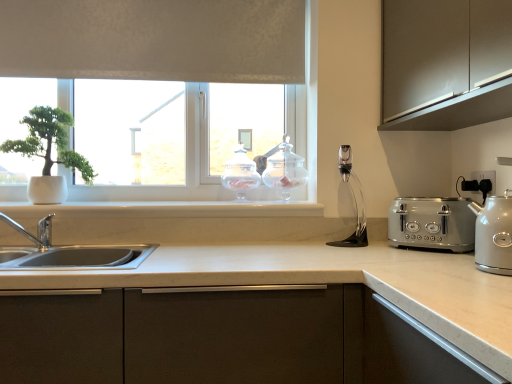
Describe the element at coordinates (432, 223) in the screenshot. Image resolution: width=512 pixels, height=384 pixels. I see `satin silver toaster at right` at that location.

The height and width of the screenshot is (384, 512). Describe the element at coordinates (485, 177) in the screenshot. I see `white plastic electric outlet at right` at that location.

Locate an element on the screen. matte brown cabinet at upper right is located at coordinates (445, 63).

Locate an element on the screen. The height and width of the screenshot is (384, 512). clear glass jar at center, acting as the first appliance starting from the left is located at coordinates (240, 173).

The width and height of the screenshot is (512, 384). Find the location of `white marble window sill at center`. white marble window sill at center is located at coordinates (165, 209).

Where is `kitchen appliance on the right of satin silver toaster at right`? Image resolution: width=512 pixels, height=384 pixels. kitchen appliance on the right of satin silver toaster at right is located at coordinates (494, 234).

Is satin silver kettle at right not within satin silver toaster at right?

Yes, satin silver kettle at right is located beyond the bounds of satin silver toaster at right.

Which is closer to the camera, (x=503, y=235) or (x=399, y=214)?

The point (x=503, y=235) is closer to the camera.

Based on the photo, from the image's perspective, is satin silver kettle at right on top of satin silver toaster at right?

No, from the image's perspective, satin silver kettle at right is not above satin silver toaster at right.

From their relative heights in the image, would you say clear glass jar at center, acting as the first appliance starting from the left, is taller or shorter than white plastic electric outlet at right?

clear glass jar at center, acting as the first appliance starting from the left, is taller than white plastic electric outlet at right.

From a real-world perspective, which is physically below, clear glass jar at center, acting as the first appliance starting from the left, or white plastic electric outlet at right?

white plastic electric outlet at right, from a real-world perspective.

From the image's perspective, is clear glass jar at center, arranged as the second appliance when viewed from the right, located beneath white plastic electric outlet at right?

Incorrect, from the image's perspective, clear glass jar at center, arranged as the second appliance when viewed from the right, is higher than white plastic electric outlet at right.

Is clear glass jar at center, arranged as the second appliance when viewed from the right, surrounding white plastic electric outlet at right?

No.

Considering the sizes of objects white matte window at upper center and white marble window sill at center in the image provided, who is taller, white matte window at upper center or white marble window sill at center?

white matte window at upper center is taller.

Is white matte window at upper center at the left side of white marble window sill at center?

Yes.

Is white matte window at upper center with white marble window sill at center?

No, white matte window at upper center is not in contact with white marble window sill at center.

Is point (190, 4) closer or farther from the camera than point (475, 245)?

Clearly, point (190, 4) is more distant from the camera than point (475, 245).

There is a satin silver kettle at right. Where is `window above it (from a real-world perspective)`? Image resolution: width=512 pixels, height=384 pixels. window above it (from a real-world perspective) is located at coordinates (x=159, y=39).

Looking at this image, considering the relative sizes of white matte window at upper center and satin silver kettle at right in the image provided, is white matte window at upper center bigger than satin silver kettle at right?

Yes, white matte window at upper center is bigger than satin silver kettle at right.

Does satin silver toaster at right have a smaller size compared to white matte window at upper center?

Yes, satin silver toaster at right is smaller than white matte window at upper center.

At what (x,y) coordinates should I click in order to perform the action: click on toaster below the white matte window at upper center (from a real-world perspective). Please return your answer as a coordinate pair (x, y). The image size is (512, 384). Looking at the image, I should click on (432, 223).

Between satin silver toaster at right and white matte window at upper center, which one is positioned behind?

white matte window at upper center is further from the camera.

Is satin silver toaster at right outside of white matte window at upper center?

Yes, satin silver toaster at right is outside of white matte window at upper center.

In the scene shown: Is satin silver kettle at right not within white marble window sill at center?

Yes.

Considering their positions, is satin silver kettle at right located in front of or behind white marble window sill at center?

Clearly, satin silver kettle at right is in front of white marble window sill at center.

Does satin silver kettle at right touch white marble window sill at center?

satin silver kettle at right and white marble window sill at center are not in contact.

What's the angular difference between satin silver kettle at right and white marble window sill at center's facing directions?

The angular difference between satin silver kettle at right and white marble window sill at center is 90.9 degrees.

In the image, is matte brown cabinet at upper right positioned in front of or behind white marble window sill at center?

Visually, matte brown cabinet at upper right is located in front of white marble window sill at center.

From the image's perspective, is matte brown cabinet at upper right positioned above or below white marble window sill at center?

Clearly, from the image's perspective, matte brown cabinet at upper right is above white marble window sill at center.

From a real-world perspective, is matte brown cabinet at upper right on top of white marble window sill at center?

Yes, from a real-world perspective, matte brown cabinet at upper right is on top of white marble window sill at center.

Considering the relative sizes of matte brown cabinet at upper right and white marble window sill at center in the image provided, is matte brown cabinet at upper right bigger than white marble window sill at center?

Yes, matte brown cabinet at upper right is bigger than white marble window sill at center.

You are a GUI agent. You are given a task and a screenshot of the screen. Output one action in this format:
    pyautogui.click(x=<x>, y=<y>)
    Task: Click on the kitchen appliance below the satin silver toaster at right (from the image's perspective)
    The height and width of the screenshot is (384, 512).
    Given the screenshot: What is the action you would take?
    pyautogui.click(x=494, y=234)

In the image, there is a clear glass jar at center, acting as the first appliance starting from the left. Where is `electric outlet below it (from a real-world perspective)`? Image resolution: width=512 pixels, height=384 pixels. electric outlet below it (from a real-world perspective) is located at coordinates (485, 177).

When comparing their distances from satin silver toaster at right, does matte brown cabinet at upper right or clear glass jar at upper center, which is the second appliance in left-to-right order, seem closer?

matte brown cabinet at upper right.

When comparing their distances from satin silver toaster at right, does white marble window sill at center or clear glass jar at upper center, marked as the 1th appliance in a right-to-left arrangement, seem closer?

white marble window sill at center lies closer to satin silver toaster at right than the other object.

From the image, which object appears to be farther from satin silver kettle at right, white matte pot at left or clear glass jar at center, arranged as the second appliance when viewed from the right?

white matte pot at left is further to satin silver kettle at right.

Estimate the real-world distances between objects in this image. Which object is closer to clear glass jar at upper center, which is the second appliance in left-to-right order, white plastic electric outlet at right or satin silver kettle at right?

white plastic electric outlet at right is positioned closer to the anchor clear glass jar at upper center, which is the second appliance in left-to-right order.

Which object lies further to the anchor point clear glass jar at upper center, which is the second appliance in left-to-right order, white matte pot at left or matte brown cabinet at upper right?

white matte pot at left is further to clear glass jar at upper center, which is the second appliance in left-to-right order.

Based on their spatial positions, is satin silver toaster at right or clear glass jar at center, arranged as the second appliance when viewed from the right, closer to satin silver kettle at right?

The object closer to satin silver kettle at right is satin silver toaster at right.

Estimate the real-world distances between objects in this image. Which object is further from satin silver kettle at right, white marble window sill at center or matte brown cabinet at upper right?

white marble window sill at center.

Considering their positions, is matte brown cabinet at upper right positioned closer to white marble window sill at center than satin silver kettle at right?

Among the two, matte brown cabinet at upper right is located nearer to white marble window sill at center.

Find the location of a particular element. kitchen appliance situated between white matte pot at left and white plastic electric outlet at right from left to right is located at coordinates (494, 234).

The image size is (512, 384). I want to click on kitchen appliance located between matte brown cabinet at upper right and clear glass jar at upper center, marked as the 1th appliance in a right-to-left arrangement, in the depth direction, so click(x=494, y=234).

This screenshot has height=384, width=512. Identify the location of window sill between white matte pot at left and clear glass jar at center, arranged as the second appliance when viewed from the right, from left to right. (165, 209).

Where is `appliance between clear glass jar at center, acting as the first appliance starting from the left, and satin silver toaster at right, in the horizontal direction`? appliance between clear glass jar at center, acting as the first appliance starting from the left, and satin silver toaster at right, in the horizontal direction is located at coordinates (284, 170).